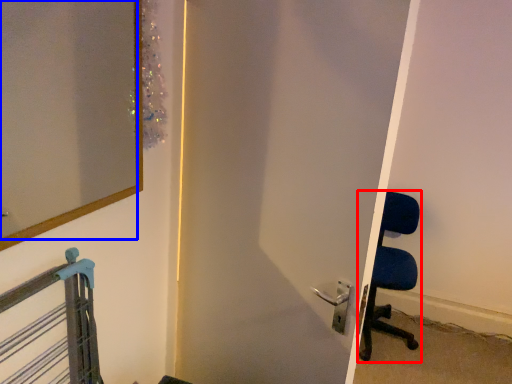
Question: Which object is closer to the camera taking this photo, chair (highlighted by a red box) or mirror (highlighted by a blue box)?

Choices:
 (A) chair
 (B) mirror

Answer: (B)